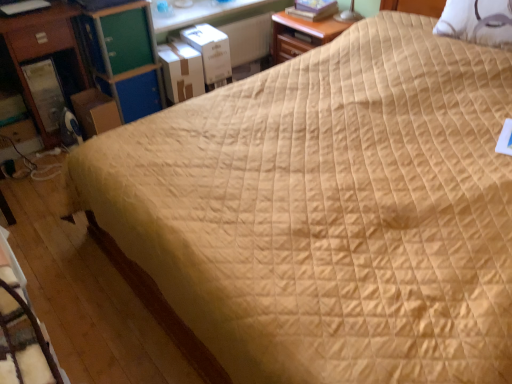
I want to click on vacant area on top of white cardboard box at upper center, which appears as the 3th cardboard box when viewed from the left (from a real-world perspective), so click(x=204, y=31).